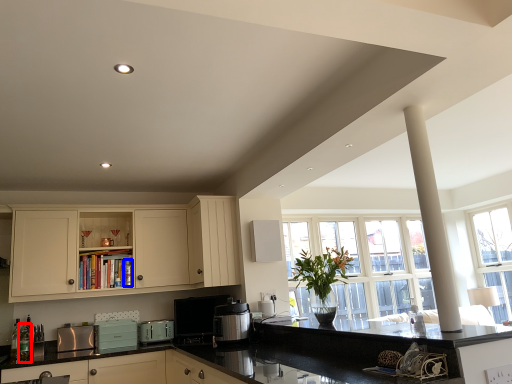
Question: Which of the following is the farthest to the observer, bottle (highlighted by a red box) or bottle (highlighted by a blue box)?

Choices:
 (A) bottle
 (B) bottle

Answer: (B)